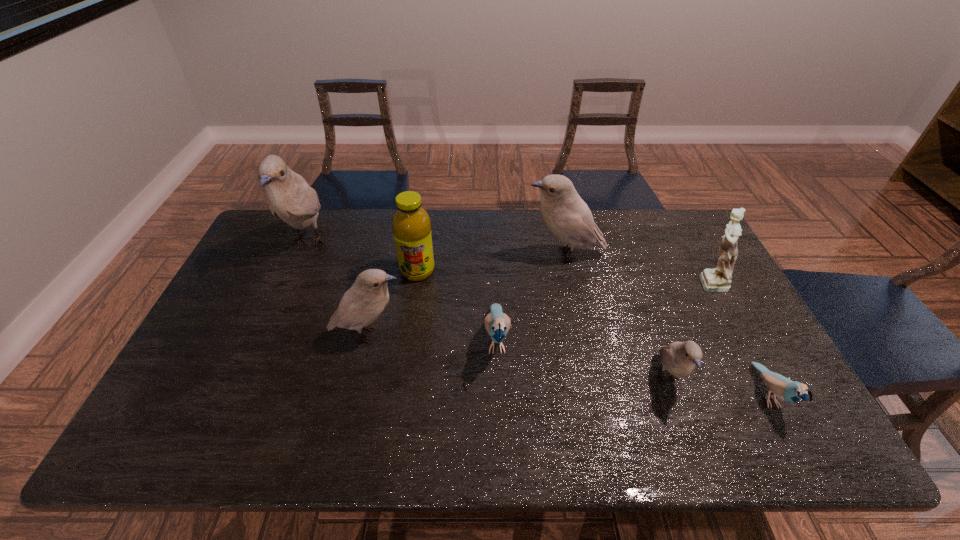
Find the location of a particular element. The width and height of the screenshot is (960, 540). object at the near right corner is located at coordinates (790, 391).

What are the coordinates of `free space at the far edge` in the screenshot? It's located at (358, 236).

Find the location of a particular element. vacant space at the near edge is located at coordinates (339, 443).

The height and width of the screenshot is (540, 960). In the image, there is a desktop. In order to click on free region at the left edge in this screenshot , I will do `click(270, 313)`.

Find the location of a particular element. Image resolution: width=960 pixels, height=540 pixels. free space at the far left corner of the desktop is located at coordinates (287, 235).

Image resolution: width=960 pixels, height=540 pixels. I want to click on free space at the near left corner of the desktop, so click(189, 432).

Identify the location of vacant space at the near right corner of the desktop. (810, 431).

Identify the location of free space between the third tallest bird and the fruit juice. The image size is (960, 540). (393, 302).

This screenshot has height=540, width=960. Identify the location of vacant region between the rightmost white bird and the fourth bird from left to right. (616, 316).

Where is `free space that is in between the fourth shortest bird and the figurine`? free space that is in between the fourth shortest bird and the figurine is located at coordinates (539, 308).